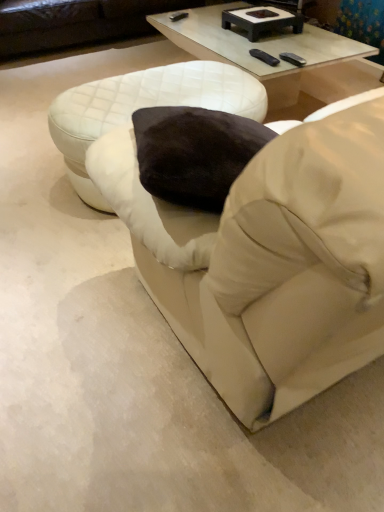
Question: From a real-world perspective, is clear glass coffee table at upper center positioned over matte white studio couch at upper center based on gravity?

Choices:
 (A) no
 (B) yes

Answer: (A)

Question: Can you confirm if clear glass coffee table at upper center is positioned to the right of matte white studio couch at upper center?

Choices:
 (A) no
 (B) yes

Answer: (B)

Question: From the image's perspective, is clear glass coffee table at upper center on matte white studio couch at upper center?

Choices:
 (A) yes
 (B) no

Answer: (B)

Question: Is clear glass coffee table at upper center wider than matte white studio couch at upper center?

Choices:
 (A) no
 (B) yes

Answer: (A)

Question: From a real-world perspective, is clear glass coffee table at upper center beneath matte white studio couch at upper center?

Choices:
 (A) no
 (B) yes

Answer: (B)

Question: Can you confirm if clear glass coffee table at upper center is bigger than matte white studio couch at upper center?

Choices:
 (A) yes
 (B) no

Answer: (B)

Question: Can you confirm if black matte rectangular tray at upper center is positioned to the left of white quilted ottoman at center?

Choices:
 (A) no
 (B) yes

Answer: (A)

Question: Can you confirm if black matte rectangular tray at upper center is smaller than white quilted ottoman at center?

Choices:
 (A) no
 (B) yes

Answer: (B)

Question: Is black matte rectangular tray at upper center not inside white quilted ottoman at center?

Choices:
 (A) yes
 (B) no

Answer: (A)

Question: Is black matte rectangular tray at upper center thinner than white quilted ottoman at center?

Choices:
 (A) no
 (B) yes

Answer: (B)

Question: Would you say white quilted ottoman at center is part of black matte rectangular tray at upper center's contents?

Choices:
 (A) no
 (B) yes

Answer: (A)

Question: Does black matte rectangular tray at upper center have a greater width compared to white quilted ottoman at center?

Choices:
 (A) no
 (B) yes

Answer: (A)

Question: Is the surface of beige fabric bean bag chair at center in direct contact with clear glass coffee table at upper center?

Choices:
 (A) yes
 (B) no

Answer: (B)